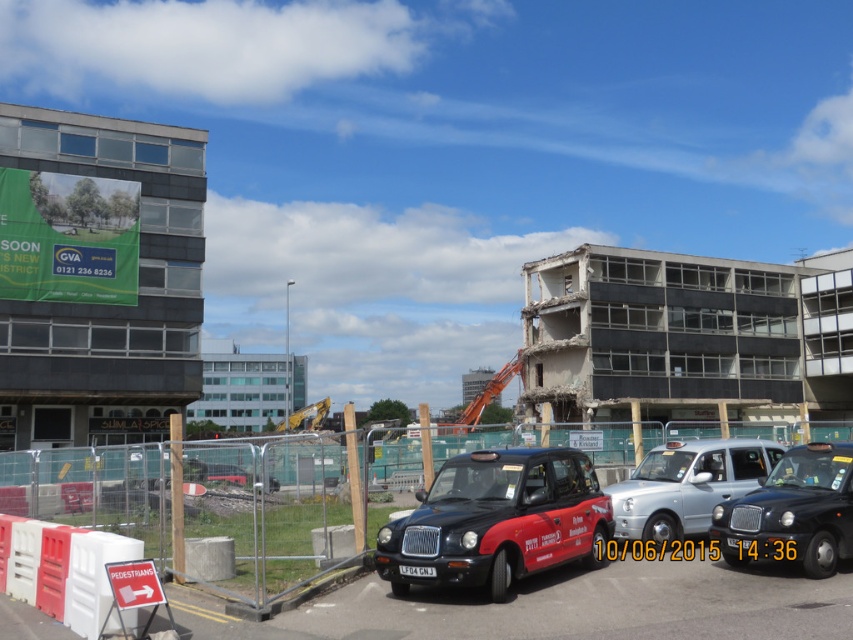
Question: Is metallic construction crane at center wider than black matte taxi at center?

Choices:
 (A) yes
 (B) no

Answer: (A)

Question: Which is farther from the silver metallic taxi at center?

Choices:
 (A) black matte taxi at center
 (B) metallic construction crane at center
 (C) black plastic license plate at center

Answer: (C)

Question: Can you confirm if silver metallic taxi at center is positioned below black plastic license plate at center?

Choices:
 (A) no
 (B) yes

Answer: (A)

Question: Among these objects, which one is nearest to the camera?

Choices:
 (A) matte black taxi at center
 (B) black plastic license plate at center
 (C) black matte taxi at center
 (D) metallic construction crane at center

Answer: (D)

Question: Can you confirm if black matte taxi at center is thinner than black plastic license plate at center?

Choices:
 (A) yes
 (B) no

Answer: (B)

Question: Among these points, which one is farthest from the camera?

Choices:
 (A) (819, 467)
 (B) (57, 580)
 (C) (666, 472)

Answer: (C)